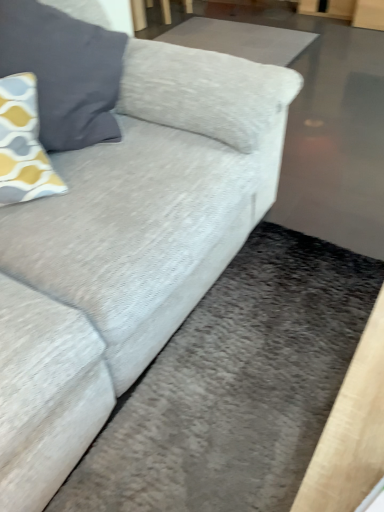
Question: Can you confirm if smooth gray flat at upper center is taller than yellow-gray patterned pillow at upper left?

Choices:
 (A) yes
 (B) no

Answer: (B)

Question: Is smooth gray flat at upper center far from yellow-gray patterned pillow at upper left?

Choices:
 (A) no
 (B) yes

Answer: (B)

Question: Is smooth gray flat at upper center outside of yellow-gray patterned pillow at upper left?

Choices:
 (A) no
 (B) yes

Answer: (B)

Question: Is smooth gray flat at upper center wider than yellow-gray patterned pillow at upper left?

Choices:
 (A) no
 (B) yes

Answer: (B)

Question: From the image's perspective, would you say smooth gray flat at upper center is shown under yellow-gray patterned pillow at upper left?

Choices:
 (A) yes
 (B) no

Answer: (B)

Question: From a real-world perspective, does smooth gray flat at upper center sit lower than yellow-gray patterned pillow at upper left?

Choices:
 (A) no
 (B) yes

Answer: (B)

Question: Can you confirm if yellow-gray patterned pillow at upper left is positioned to the right of smooth gray flat at upper center?

Choices:
 (A) yes
 (B) no

Answer: (B)

Question: Would you say smooth gray flat at upper center is part of yellow-gray patterned pillow at upper left's contents?

Choices:
 (A) yes
 (B) no

Answer: (B)

Question: Can we say yellow-gray patterned pillow at upper left lies outside smooth gray flat at upper center?

Choices:
 (A) yes
 (B) no

Answer: (A)

Question: Considering the relative sizes of yellow-gray patterned pillow at upper left and smooth gray flat at upper center in the image provided, is yellow-gray patterned pillow at upper left bigger than smooth gray flat at upper center?

Choices:
 (A) yes
 (B) no

Answer: (A)

Question: Considering the relative positions of yellow-gray patterned pillow at upper left and smooth gray flat at upper center in the image provided, is yellow-gray patterned pillow at upper left to the left of smooth gray flat at upper center from the viewer's perspective?

Choices:
 (A) yes
 (B) no

Answer: (A)

Question: Does yellow-gray patterned pillow at upper left have a smaller size compared to smooth gray flat at upper center?

Choices:
 (A) yes
 (B) no

Answer: (B)

Question: From a real-world perspective, is yellow-gray patterned pillow at upper left physically located above or below smooth gray flat at upper center?

Choices:
 (A) above
 (B) below

Answer: (A)